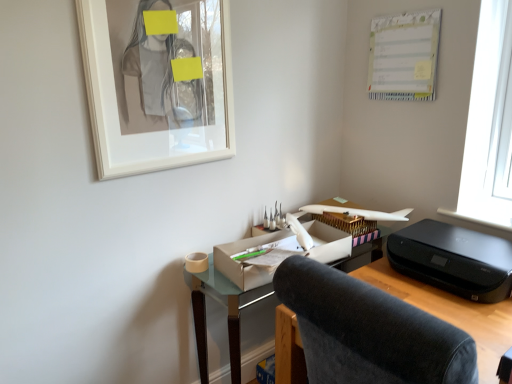
Question: Is white glossy picture frame at upper left to the left or to the right of velvet dark gray chair at center in the image?

Choices:
 (A) left
 (B) right

Answer: (A)

Question: From a real-world perspective, is white glossy picture frame at upper left above or below velvet dark gray chair at center?

Choices:
 (A) above
 (B) below

Answer: (A)

Question: Which is farther from the white paperboard at upper right?

Choices:
 (A) velvet dark gray chair at center
 (B) matte cardboard desk at center
 (C) white glossy picture frame at upper left
 (D) matte cardboard box at center
 (E) black plastic printer at right

Answer: (A)

Question: Which object is the closest to the velvet dark gray chair at center?

Choices:
 (A) matte cardboard desk at center
 (B) black plastic printer at right
 (C) white paperboard at upper right
 (D) matte cardboard box at center
 (E) white glossy picture frame at upper left

Answer: (D)